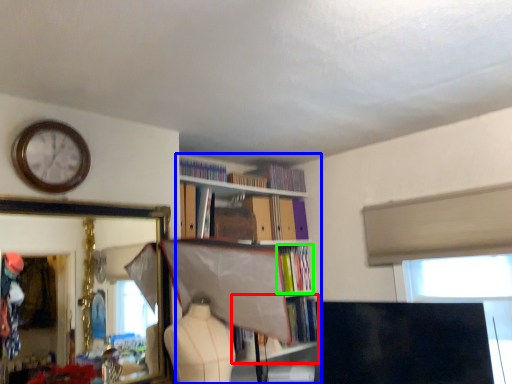
Question: Estimate the real-world distances between objects in this image. Which object is farther from book (highlighted by a red box), bookcase (highlighted by a blue box) or book (highlighted by a green box)?

Choices:
 (A) bookcase
 (B) book

Answer: (A)